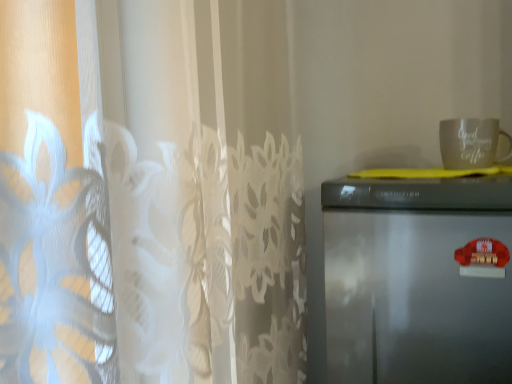
Measure the distance between matte white mug at upper right and camera.

matte white mug at upper right is 3.32 feet away from camera.

The height and width of the screenshot is (384, 512). What do you see at coordinates (471, 143) in the screenshot? I see `matte white mug at upper right` at bounding box center [471, 143].

Measure the distance between point (474, 155) and camera.

Point (474, 155) and camera are 1.02 meters apart.

In order to face matte white mug at upper right, should I rotate leftwards or rightwards?

Rotate right and turn 28.082 degrees.

Where is `matte white mug at upper right`? This screenshot has width=512, height=384. matte white mug at upper right is located at coordinates (471, 143).

Describe the element at coordinates (418, 280) in the screenshot. I see `satin silver refrigerator at right` at that location.

Locate an element on the screen. This screenshot has height=384, width=512. satin silver refrigerator at right is located at coordinates (418, 280).

The image size is (512, 384). I want to click on matte white mug at upper right, so click(x=471, y=143).

Consider the image. Based on their positions, is matte white mug at upper right located to the left or right of satin silver refrigerator at right?

matte white mug at upper right is to the right of satin silver refrigerator at right.

Considering the positions of objects matte white mug at upper right and satin silver refrigerator at right in the image provided, who is in front, matte white mug at upper right or satin silver refrigerator at right?

Positioned in front is satin silver refrigerator at right.

Does point (490, 148) come in front of point (409, 309)?

No, (490, 148) is behind (409, 309).

In the scene shown: From the image's perspective, which one is positioned lower, matte white mug at upper right or satin silver refrigerator at right?

satin silver refrigerator at right is shown below in the image.

From a real-world perspective, which is physically above, matte white mug at upper right or satin silver refrigerator at right?

matte white mug at upper right, from a real-world perspective.

Can you confirm if matte white mug at upper right is wider than satin silver refrigerator at right?

No, matte white mug at upper right is not wider than satin silver refrigerator at right.

Considering the sizes of objects matte white mug at upper right and satin silver refrigerator at right in the image provided, who is taller, matte white mug at upper right or satin silver refrigerator at right?

Standing taller between the two is satin silver refrigerator at right.

Considering the relative sizes of matte white mug at upper right and satin silver refrigerator at right in the image provided, is matte white mug at upper right bigger than satin silver refrigerator at right?

No.

Would you say matte white mug at upper right contains satin silver refrigerator at right?

No, satin silver refrigerator at right is not inside matte white mug at upper right.

Is matte white mug at upper right far away from satin silver refrigerator at right?

matte white mug at upper right is actually quite close to satin silver refrigerator at right.

Is matte white mug at upper right aimed at satin silver refrigerator at right?

No, matte white mug at upper right is not turned towards satin silver refrigerator at right.

How many degrees apart are the facing directions of matte white mug at upper right and satin silver refrigerator at right?

They differ by 1.92 degrees in their facing directions.

Locate an element on the screen. The width and height of the screenshot is (512, 384). refrigerator that is below the matte white mug at upper right (from the image's perspective) is located at coordinates (418, 280).

From the picture: Considering the relative positions of satin silver refrigerator at right and matte white mug at upper right in the image provided, is satin silver refrigerator at right to the right of matte white mug at upper right from the viewer's perspective?

No, satin silver refrigerator at right is not to the right of matte white mug at upper right.

Does satin silver refrigerator at right lie behind matte white mug at upper right?

No.

Is point (358, 219) behind point (498, 126)?

No.

From the image's perspective, is satin silver refrigerator at right above or below matte white mug at upper right?

Based on their image positions, satin silver refrigerator at right is located beneath matte white mug at upper right.

From a real-world perspective, who is located lower, satin silver refrigerator at right or matte white mug at upper right?

satin silver refrigerator at right.

Looking at their sizes, would you say satin silver refrigerator at right is wider or thinner than matte white mug at upper right?

Clearly, satin silver refrigerator at right has more width compared to matte white mug at upper right.

Which of these two, satin silver refrigerator at right or matte white mug at upper right, stands shorter?

matte white mug at upper right.

Is satin silver refrigerator at right bigger than matte white mug at upper right?

Yes.

Which is correct: satin silver refrigerator at right is inside matte white mug at upper right, or outside of it?

satin silver refrigerator at right lies outside matte white mug at upper right.

Is satin silver refrigerator at right beside matte white mug at upper right?

No, satin silver refrigerator at right is not next to matte white mug at upper right.

Is satin silver refrigerator at right facing away from matte white mug at upper right?

That's not correct — satin silver refrigerator at right is not looking away from matte white mug at upper right.

How different are the orientations of satin silver refrigerator at right and matte white mug at upper right in degrees?

1.92 degrees.

Where is `refrigerator below the matte white mug at upper right (from the image's perspective)`? This screenshot has height=384, width=512. refrigerator below the matte white mug at upper right (from the image's perspective) is located at coordinates (418, 280).

Where is `refrigerator located on the left of matte white mug at upper right`? refrigerator located on the left of matte white mug at upper right is located at coordinates [x=418, y=280].

Locate an element on the screen. refrigerator in front of the matte white mug at upper right is located at coordinates (418, 280).